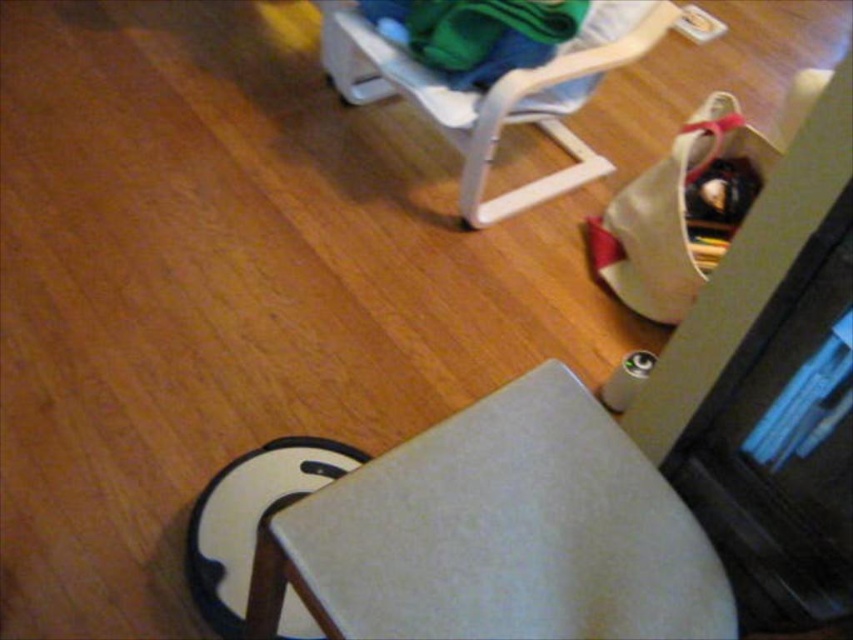
Question: Which object appears farthest from the camera in this image?

Choices:
 (A) white plastic folding chair at upper center
 (B) matte gray cushion at lower center

Answer: (A)

Question: Can you confirm if matte gray cushion at lower center is positioned below white plastic folding chair at upper center?

Choices:
 (A) no
 (B) yes

Answer: (B)

Question: Which of the following is the farthest from the observer?

Choices:
 (A) (335, 28)
 (B) (285, 552)

Answer: (A)

Question: Is matte gray cushion at lower center further to the viewer compared to white plastic folding chair at upper center?

Choices:
 (A) yes
 (B) no

Answer: (B)

Question: Which point is closer to the camera?

Choices:
 (A) white plastic folding chair at upper center
 (B) matte gray cushion at lower center

Answer: (B)

Question: Does matte gray cushion at lower center appear over white plastic folding chair at upper center?

Choices:
 (A) no
 (B) yes

Answer: (A)